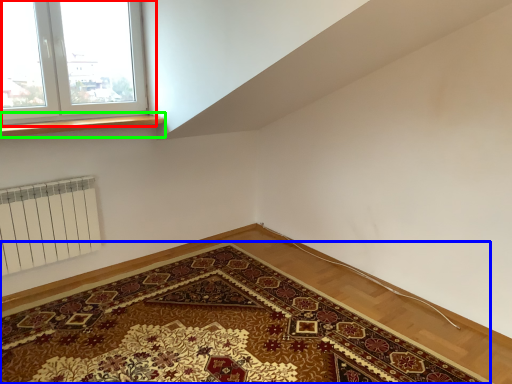
Question: Considering the real-world distances, which object is closest to window (highlighted by a red box)? mat (highlighted by a blue box) or window sill (highlighted by a green box).

Choices:
 (A) mat
 (B) window sill

Answer: (B)